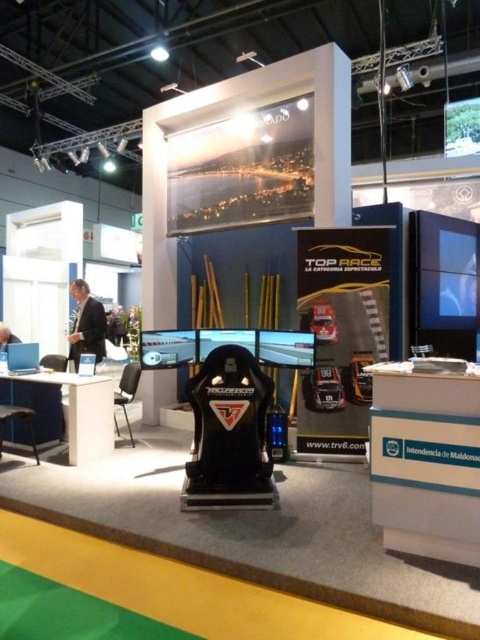
You are at the exhibition and want to locate the black suit at left. According to the coordinates provided, where should you look?

The black suit at left is located at coordinates point (86,324).

You are at the exhibition and want to take a photo of the black suit at left and the matte black chair at lower left. Which object should you focus on first if you want to capture both in the frame without moving the camera?

The matte black chair at lower left should be focused on first because the black suit at left is positioned to its right, meaning the chair is closer to the camera. By focusing on the closer object, both will be in focus if they are within the camera lens depth of field.